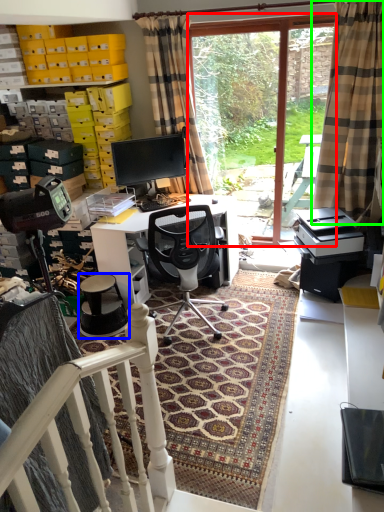
Question: Which is farther away from bay window (highlighted by a red box)? stool (highlighted by a blue box) or curtain (highlighted by a green box)?

Choices:
 (A) stool
 (B) curtain

Answer: (A)